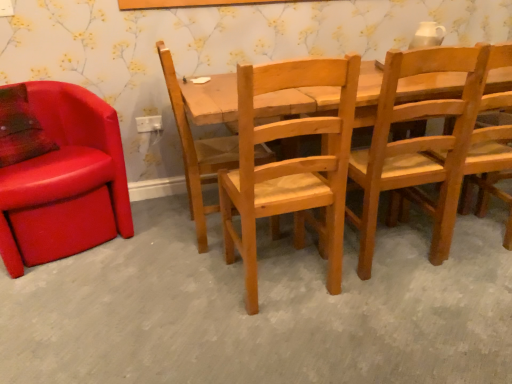
At what (x,y) coordinates should I click in order to perform the action: click on vacant space positioned to the left of natural wood chair at center, placed as the third chair when sorted from left to right. Please return your answer as a coordinate pair (x, y). Looking at the image, I should click on (187, 292).